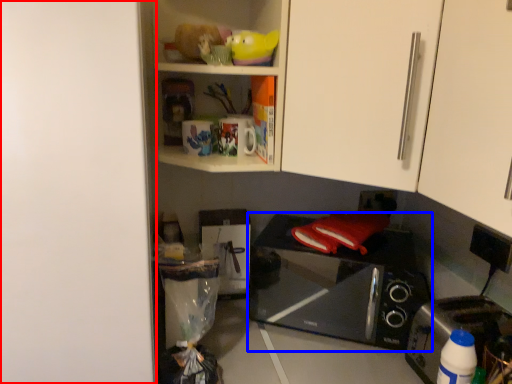
Question: Which of the following is the farthest to the observer, door (highlighted by a red box) or microwave oven (highlighted by a blue box)?

Choices:
 (A) door
 (B) microwave oven

Answer: (B)